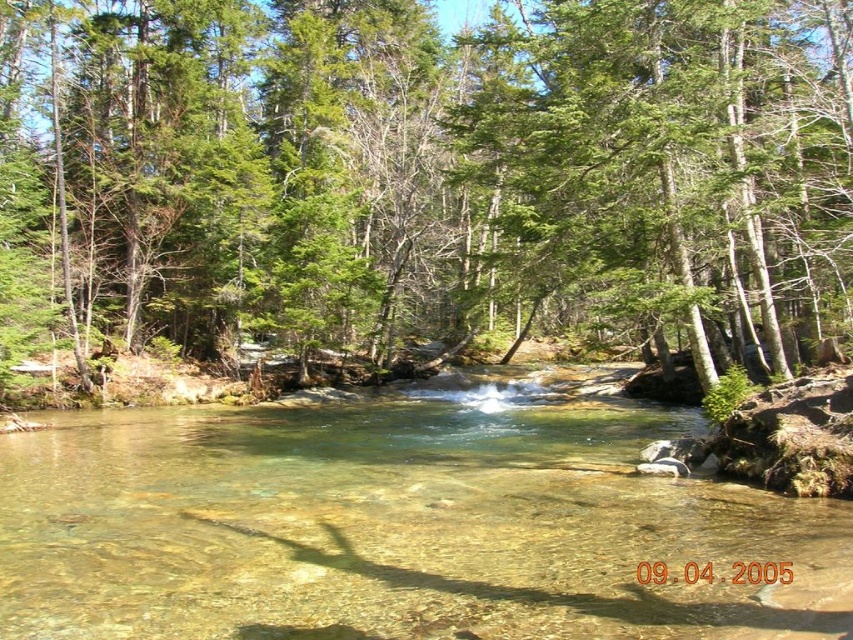
Question: Is green leafy tree at center positioned behind clear glass river at center?

Choices:
 (A) yes
 (B) no

Answer: (A)

Question: Where is green leafy tree at center located in relation to clear glass river at center in the image?

Choices:
 (A) below
 (B) above

Answer: (B)

Question: Which point appears closest to the camera in this image?

Choices:
 (A) (584, 278)
 (B) (526, 432)

Answer: (B)

Question: Does green leafy tree at center have a greater width compared to clear glass river at center?

Choices:
 (A) no
 (B) yes

Answer: (B)

Question: Which point appears farthest from the camera in this image?

Choices:
 (A) (419, 570)
 (B) (242, 301)

Answer: (B)